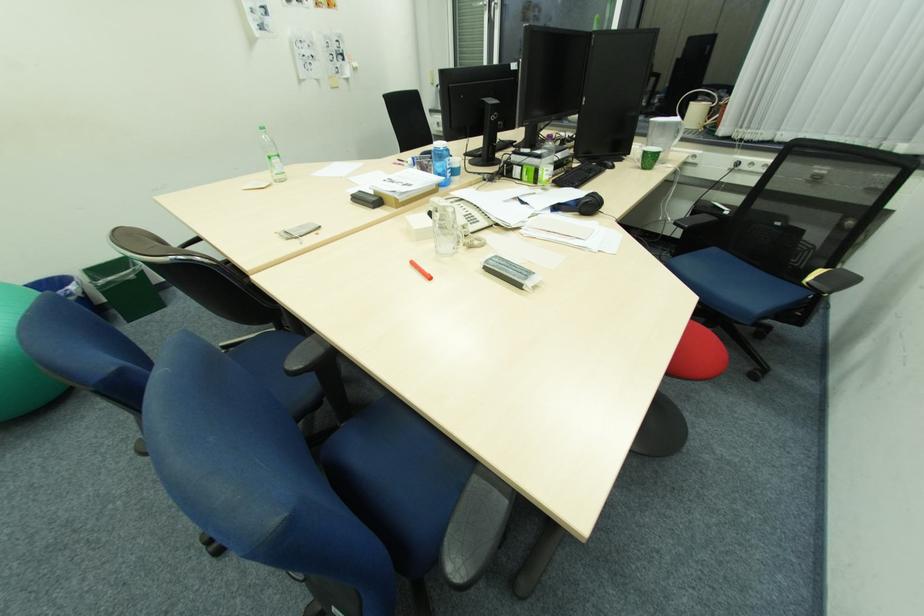
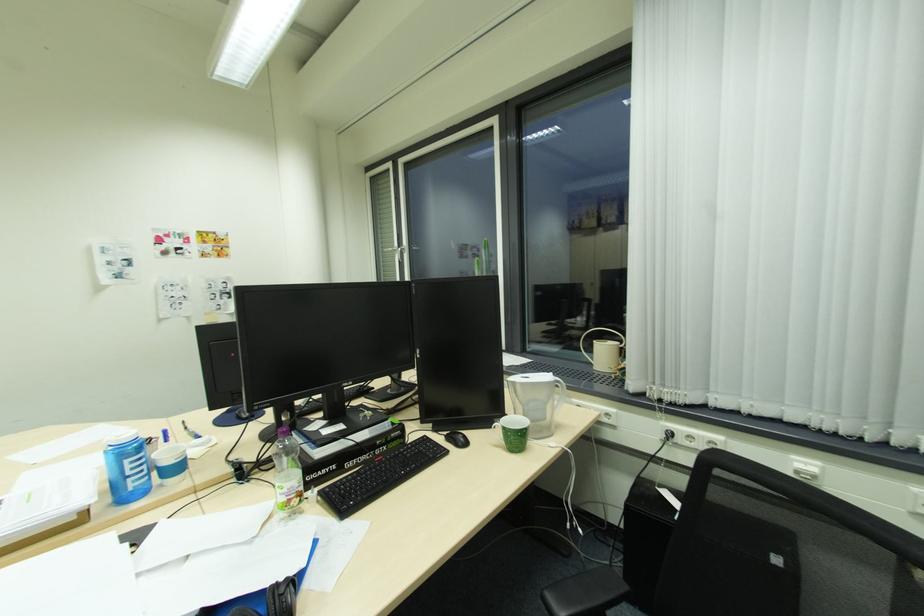
Where in the second image is the point corresponding to (x=455, y=169) from the first image?

(146, 472)